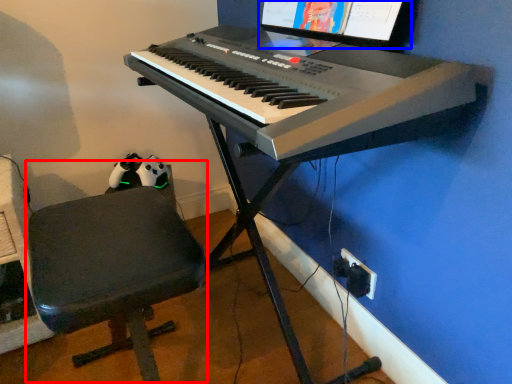
Question: Which of the following is the closest to the observer, computer chair (highlighted by a red box) or computer monitor (highlighted by a blue box)?

Choices:
 (A) computer chair
 (B) computer monitor

Answer: (A)